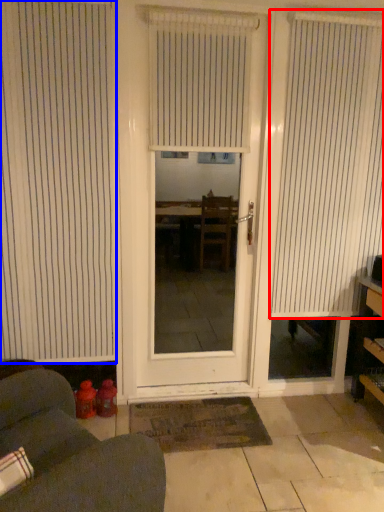
Question: Which point is further to the camera, window blind (highlighted by a red box) or window blind (highlighted by a blue box)?

Choices:
 (A) window blind
 (B) window blind

Answer: (A)